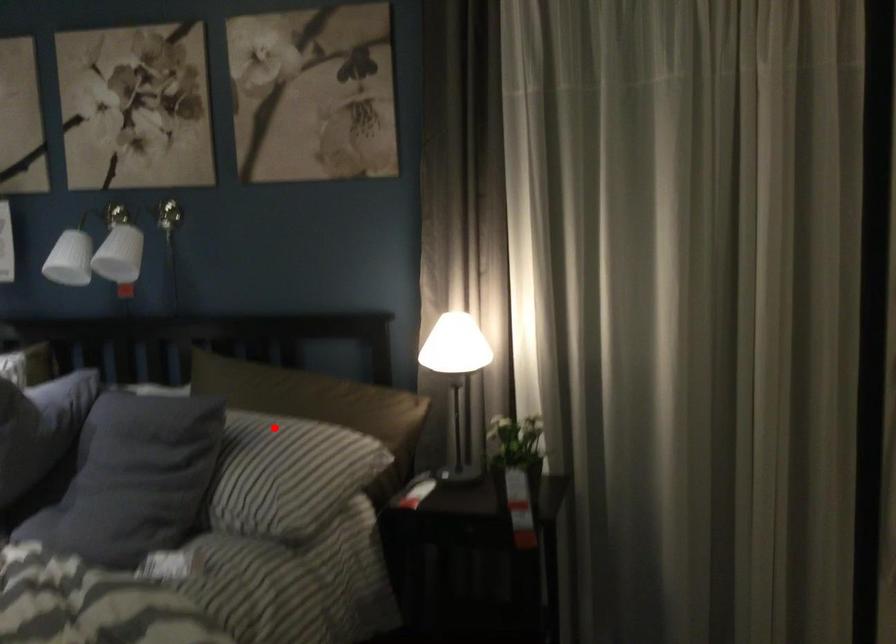
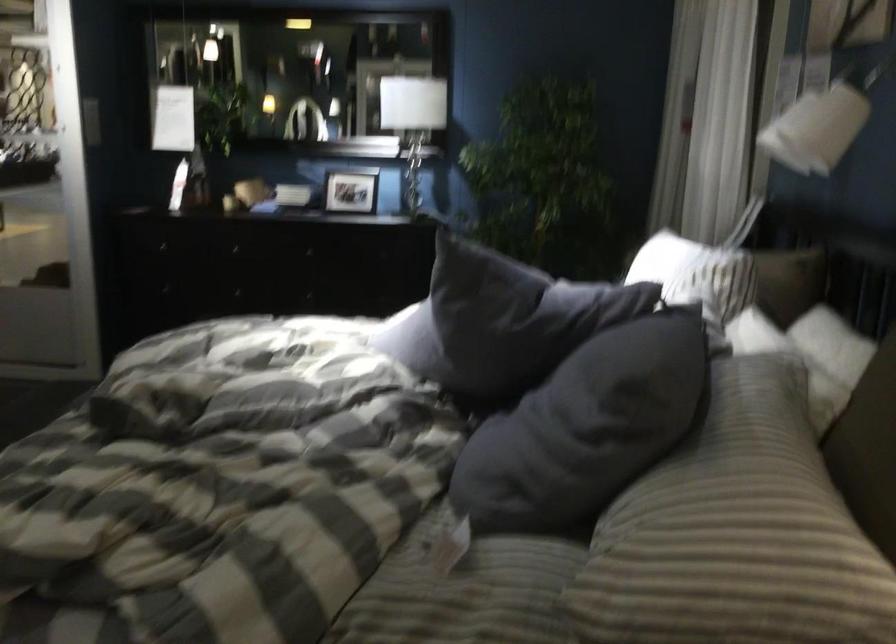
Question: I am providing you with two images of the same scene from different viewpoints. Given a red point in image1, look at the same physical point in image2. Is it:

Choices:
 (A) Closer to the viewpoint
 (B) Farther from the viewpoint

Answer: (A)